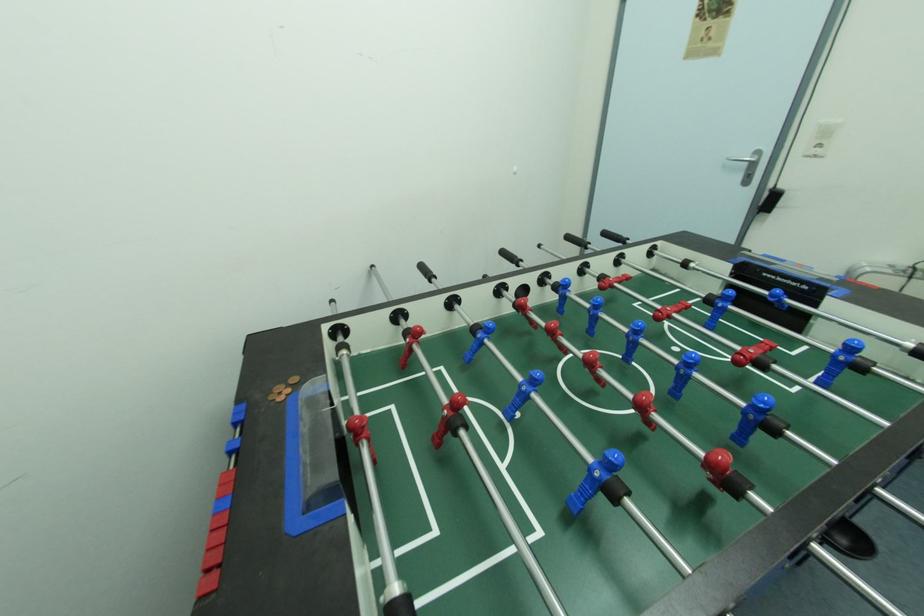
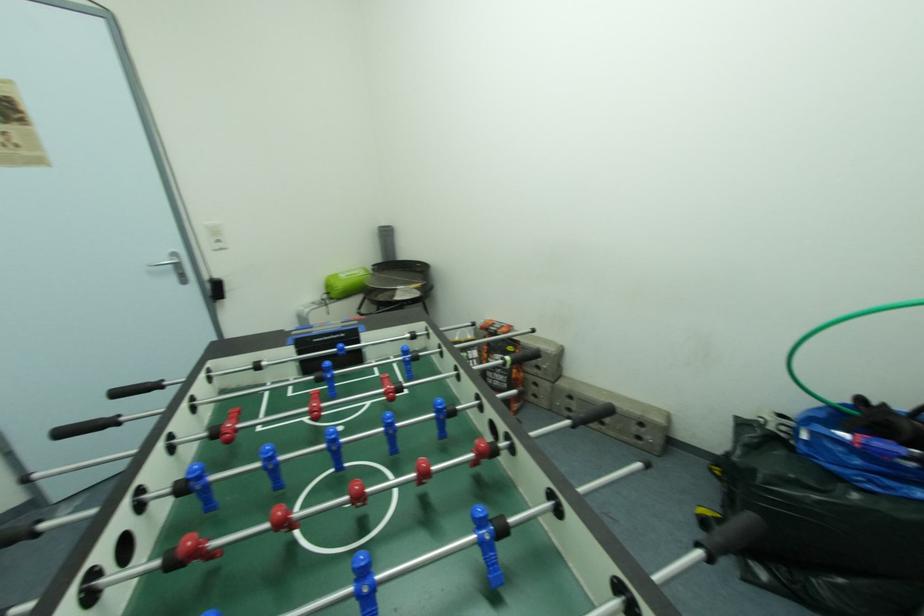
Question: Based on the continuous images, in which direction is the camera rotating? Reply with the corresponding letter.

Choices:
 (A) Left
 (B) Right
 (C) Up
 (D) Down

Answer: (B)